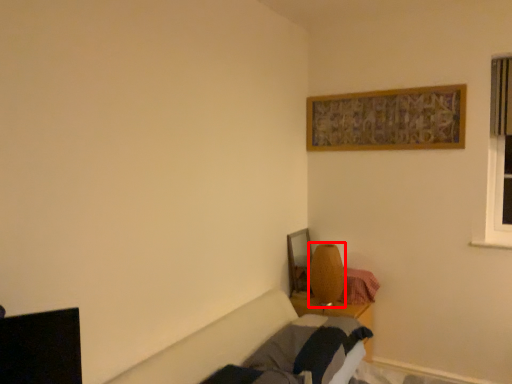
Question: From the image's perspective, where is table lamp (annotated by the red box) located relative to bed frame?

Choices:
 (A) below
 (B) above

Answer: (B)